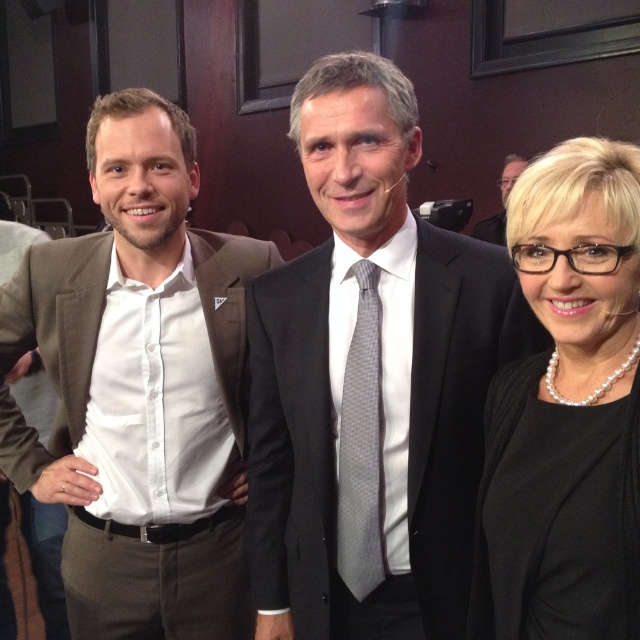
Consider the image. Based on the scene description, can you identify the object located at the coordinates point (371, 381)?

The point (371, 381) indicates the location of the black silk suit at center.

In the scene shown: In the image, there are three people posing for a photo in a formal setting. The two men on the left and center are dressed in suits. The third person is marked by a point at coordinates (566, 410). Who is this third person, and what is their position relative to the other individuals?

The point at coordinates (566, 410) indicates the presence of a pearl necklace at the center, suggesting the third person is likely a woman wearing the necklace. Since the necklace is positioned at the center, she is centrally located among the three individuals.